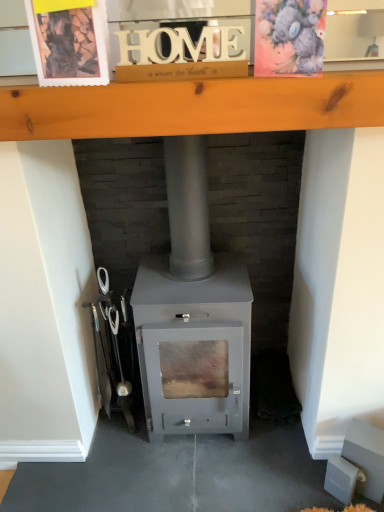
The width and height of the screenshot is (384, 512). I want to click on wooden postcard at upper left, the second postcard viewed from the right, so click(69, 44).

Identify the location of watercolor paper postcard at upper right, acting as the second postcard starting from the left. Image resolution: width=384 pixels, height=512 pixels. pyautogui.click(x=289, y=37).

Is wooden at upper center positioned far away from matte gray wood burning stove at center?

Actually, wooden at upper center and matte gray wood burning stove at center are a little close together.

Can you confirm if wooden at upper center is wider than matte gray wood burning stove at center?

Incorrect, the width of wooden at upper center does not surpass that of matte gray wood burning stove at center.

Is wooden at upper center to the left of matte gray wood burning stove at center from the viewer's perspective?

No.

Considering the sizes of objects wooden at upper center and matte gray wood burning stove at center in the image provided, who is bigger, wooden at upper center or matte gray wood burning stove at center?

matte gray wood burning stove at center.

Can we say watercolor paper postcard at upper right, acting as the second postcard starting from the left, lies outside wooden at upper center?

Indeed, watercolor paper postcard at upper right, acting as the second postcard starting from the left, is completely outside wooden at upper center.

From a real-world perspective, between watercolor paper postcard at upper right, the 1th postcard in the right-to-left sequence, and wooden at upper center, who is vertically higher?

watercolor paper postcard at upper right, the 1th postcard in the right-to-left sequence.

Find the location of a particular element. Image resolution: width=384 pixels, height=512 pixels. ledge below the watercolor paper postcard at upper right, acting as the second postcard starting from the left (from a real-world perspective) is located at coordinates (192, 106).

Considering the positions of point (312, 25) and point (76, 128), is point (312, 25) closer or farther from the camera than point (76, 128)?

Point (312, 25) is closer to the camera than point (76, 128).

Would you say matte gray wood burning stove at center is a long distance from watercolor paper postcard at upper right, acting as the second postcard starting from the left?

No, matte gray wood burning stove at center is not far away from watercolor paper postcard at upper right, acting as the second postcard starting from the left.

Is point (237, 423) positioned behind point (271, 19)?

Yes.

How much distance is there between matte gray wood burning stove at center and watercolor paper postcard at upper right, acting as the second postcard starting from the left?

matte gray wood burning stove at center is 28.86 inches away from watercolor paper postcard at upper right, acting as the second postcard starting from the left.

Where is `postcard that is the 1st one when counting upward from the matte gray wood burning stove at center (from the image's perspective)`? The height and width of the screenshot is (512, 384). postcard that is the 1st one when counting upward from the matte gray wood burning stove at center (from the image's perspective) is located at coordinates (289, 37).

In terms of width, does matte gray wood burning stove at center look wider or thinner when compared to wooden at upper center?

matte gray wood burning stove at center is wider than wooden at upper center.

Identify the location of wood burning stove lying below the wooden at upper center (from the image's perspective). The image size is (384, 512). (191, 307).

From a real-world perspective, is matte gray wood burning stove at center above or below wooden at upper center?

matte gray wood burning stove at center is below wooden at upper center.

What's the angular difference between matte gray wood burning stove at center and wooden at upper center's facing directions?

There is a 0.516-degree angle between the facing directions of matte gray wood burning stove at center and wooden at upper center.

Which object is wider, wooden at upper center or watercolor paper postcard at upper right, acting as the second postcard starting from the left?

Wider between the two is wooden at upper center.

In the scene shown: Is wooden at upper center turned away from watercolor paper postcard at upper right, acting as the second postcard starting from the left?

That's not correct — wooden at upper center is not looking away from watercolor paper postcard at upper right, acting as the second postcard starting from the left.

From a real-world perspective, is wooden at upper center above or below watercolor paper postcard at upper right, acting as the second postcard starting from the left?

wooden at upper center is below watercolor paper postcard at upper right, acting as the second postcard starting from the left.

Can you confirm if wooden at upper center is taller than watercolor paper postcard at upper right, acting as the second postcard starting from the left?

In fact, wooden at upper center may be shorter than watercolor paper postcard at upper right, acting as the second postcard starting from the left.

In terms of size, does wooden postcard at upper left, acting as the 1th postcard starting from the left, appear bigger or smaller than watercolor paper postcard at upper right, the 1th postcard in the right-to-left sequence?

wooden postcard at upper left, acting as the 1th postcard starting from the left, is smaller than watercolor paper postcard at upper right, the 1th postcard in the right-to-left sequence.

What's the angular difference between wooden postcard at upper left, the second postcard viewed from the right, and watercolor paper postcard at upper right, the 1th postcard in the right-to-left sequence,'s facing directions?

18.6 degrees.

How far apart are wooden postcard at upper left, acting as the 1th postcard starting from the left, and watercolor paper postcard at upper right, acting as the second postcard starting from the left?

wooden postcard at upper left, acting as the 1th postcard starting from the left, is 13.93 inches from watercolor paper postcard at upper right, acting as the second postcard starting from the left.

From the picture: Is wooden postcard at upper left, the second postcard viewed from the right, oriented towards watercolor paper postcard at upper right, acting as the second postcard starting from the left?

No, wooden postcard at upper left, the second postcard viewed from the right, does not turn towards watercolor paper postcard at upper right, acting as the second postcard starting from the left.

Between wooden postcard at upper left, the second postcard viewed from the right, and matte gray wood burning stove at center, which one appears on the right side from the viewer's perspective?

From the viewer's perspective, matte gray wood burning stove at center appears more on the right side.

Does wooden postcard at upper left, acting as the 1th postcard starting from the left, have a greater height compared to matte gray wood burning stove at center?

Incorrect, the height of wooden postcard at upper left, acting as the 1th postcard starting from the left, is not larger of that of matte gray wood burning stove at center.

Can matte gray wood burning stove at center be found inside wooden postcard at upper left, acting as the 1th postcard starting from the left?

Definitely not — matte gray wood burning stove at center is not inside wooden postcard at upper left, acting as the 1th postcard starting from the left.

Find the location of a particular element. Image resolution: width=384 pixels, height=512 pixels. wood burning stove on the left of the wooden at upper center is located at coordinates (191, 307).

Identify the location of ledge below the watercolor paper postcard at upper right, the 1th postcard in the right-to-left sequence (from a real-world perspective). (192, 106).

Based on their spatial positions, is wooden at upper center or wooden postcard at upper left, acting as the 1th postcard starting from the left, further from watercolor paper postcard at upper right, the 1th postcard in the right-to-left sequence?

wooden postcard at upper left, acting as the 1th postcard starting from the left, lies further to watercolor paper postcard at upper right, the 1th postcard in the right-to-left sequence, than the other object.

Which object lies nearer to the anchor point wooden at upper center, wooden postcard at upper left, the second postcard viewed from the right, or watercolor paper postcard at upper right, the 1th postcard in the right-to-left sequence?

Based on the image, wooden postcard at upper left, the second postcard viewed from the right, appears to be nearer to wooden at upper center.

When comparing their distances from matte gray wood burning stove at center, does watercolor paper postcard at upper right, acting as the second postcard starting from the left, or wooden postcard at upper left, acting as the 1th postcard starting from the left, seem further?

watercolor paper postcard at upper right, acting as the second postcard starting from the left, is further to matte gray wood burning stove at center.

When comparing their distances from wooden postcard at upper left, the second postcard viewed from the right, does matte gray wood burning stove at center or watercolor paper postcard at upper right, acting as the second postcard starting from the left, seem closer?

Based on the image, watercolor paper postcard at upper right, acting as the second postcard starting from the left, appears to be nearer to wooden postcard at upper left, the second postcard viewed from the right.

Estimate the real-world distances between objects in this image. Which object is further from watercolor paper postcard at upper right, acting as the second postcard starting from the left, wooden postcard at upper left, acting as the 1th postcard starting from the left, or matte gray wood burning stove at center?

matte gray wood burning stove at center is positioned further to the anchor watercolor paper postcard at upper right, acting as the second postcard starting from the left.

Considering their positions, is wooden at upper center positioned further to watercolor paper postcard at upper right, the 1th postcard in the right-to-left sequence, than matte gray wood burning stove at center?

matte gray wood burning stove at center.

When comparing their distances from wooden at upper center, does matte gray wood burning stove at center or watercolor paper postcard at upper right, the 1th postcard in the right-to-left sequence, seem closer?

Among the two, watercolor paper postcard at upper right, the 1th postcard in the right-to-left sequence, is located nearer to wooden at upper center.

Estimate the real-world distances between objects in this image. Which object is closer to watercolor paper postcard at upper right, the 1th postcard in the right-to-left sequence, matte gray wood burning stove at center or wooden at upper center?

wooden at upper center is closer to watercolor paper postcard at upper right, the 1th postcard in the right-to-left sequence.

Locate an element on the screen. This screenshot has height=512, width=384. postcard between wooden postcard at upper left, acting as the 1th postcard starting from the left, and matte gray wood burning stove at center in the up-down direction is located at coordinates (289, 37).

The height and width of the screenshot is (512, 384). In order to click on ledge located between wooden postcard at upper left, acting as the 1th postcard starting from the left, and watercolor paper postcard at upper right, the 1th postcard in the right-to-left sequence, in the left-right direction in this screenshot , I will do `click(192, 106)`.

This screenshot has width=384, height=512. I want to click on ledge between wooden postcard at upper left, the second postcard viewed from the right, and matte gray wood burning stove at center vertically, so 192,106.

Find the location of a particular element. Image resolution: width=384 pixels, height=512 pixels. ledge between watercolor paper postcard at upper right, the 1th postcard in the right-to-left sequence, and matte gray wood burning stove at center from top to bottom is located at coordinates point(192,106).